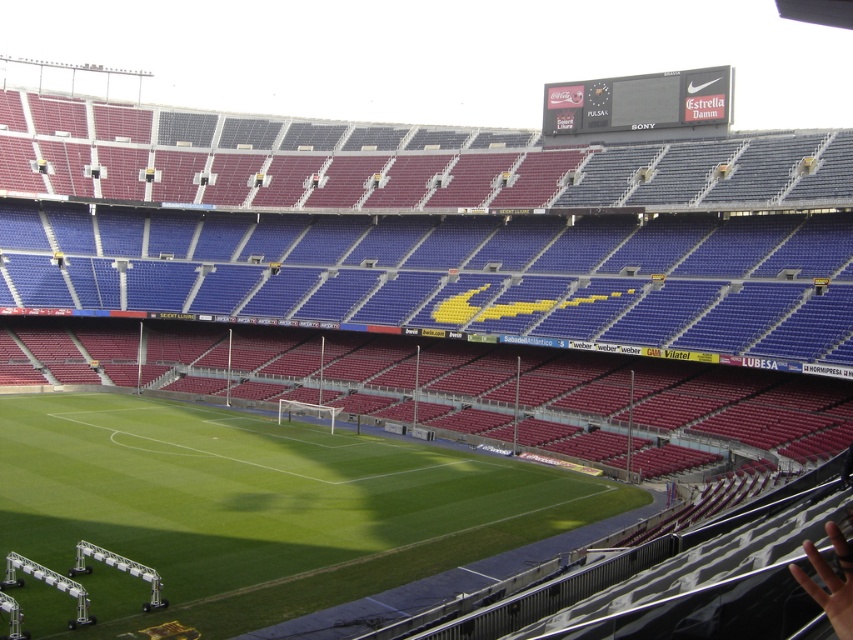
Question: Is metallic silver stadium lights at lower left further to the viewer compared to white metallic goalpost at center?

Choices:
 (A) yes
 (B) no

Answer: (B)

Question: Among these objects, which one is farthest from the camera?

Choices:
 (A) white metallic goalpost at center
 (B) green grass football field at center
 (C) metallic silver stadium lights at lower left

Answer: (A)

Question: Which object is the closest to the skinny hand at lower right?

Choices:
 (A) metallic silver stadium lights at lower left
 (B) white metallic track at lower left

Answer: (B)

Question: Which of these objects is positioned closest to the white metallic track at lower left?

Choices:
 (A) metallic silver stadium lights at lower left
 (B) skinny hand at lower right

Answer: (A)

Question: Is green grass football field at center above skinny hand at lower right?

Choices:
 (A) yes
 (B) no

Answer: (B)

Question: Can you confirm if metallic silver stadium lights at lower left is smaller than white metallic goalpost at center?

Choices:
 (A) no
 (B) yes

Answer: (B)